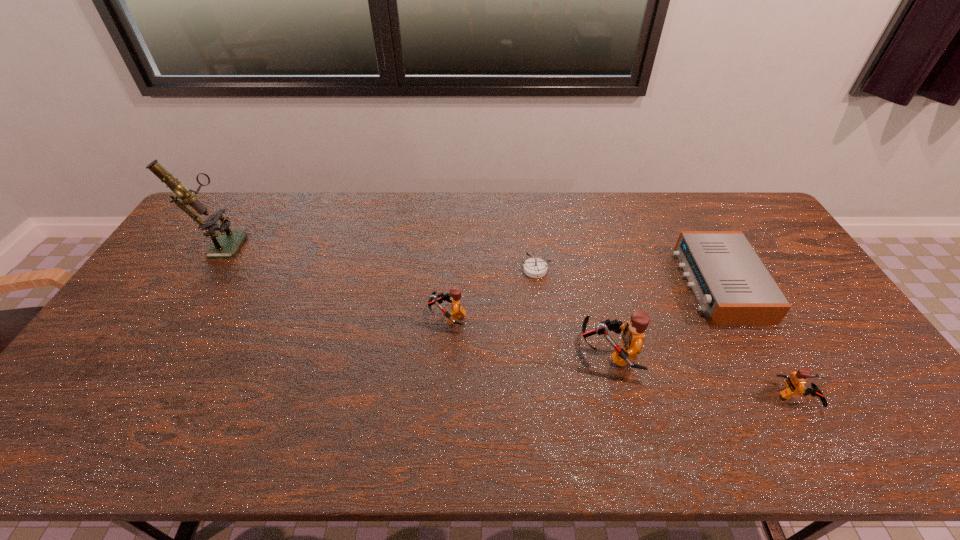
I want to click on the third tallest object, so click(x=457, y=312).

Find the location of a particular element. This screenshot has width=960, height=540. the second object from left to right is located at coordinates (457, 312).

Where is `the tallest Lego`? The height and width of the screenshot is (540, 960). the tallest Lego is located at coordinates (633, 336).

The image size is (960, 540). Find the location of `the second Lego from left to right`. the second Lego from left to right is located at coordinates (633, 336).

Locate an element on the screen. The width and height of the screenshot is (960, 540). the fourth tallest object is located at coordinates (795, 382).

This screenshot has height=540, width=960. Identify the location of the rightmost Lego. (795, 382).

Locate an element on the screen. The width and height of the screenshot is (960, 540). the leftmost object is located at coordinates (225, 245).

Image resolution: width=960 pixels, height=540 pixels. In order to click on microscope in this screenshot , I will do `click(225, 245)`.

You are a GUI agent. You are given a task and a screenshot of the screen. Output one action in this format:
    pyautogui.click(x=<x>, y=<y>)
    Task: Click on the radio receiver
    This screenshot has height=540, width=960.
    Given the screenshot: What is the action you would take?
    pyautogui.click(x=733, y=287)

Locate an element on the screen. Image resolution: width=960 pixels, height=540 pixels. compass is located at coordinates (534, 267).